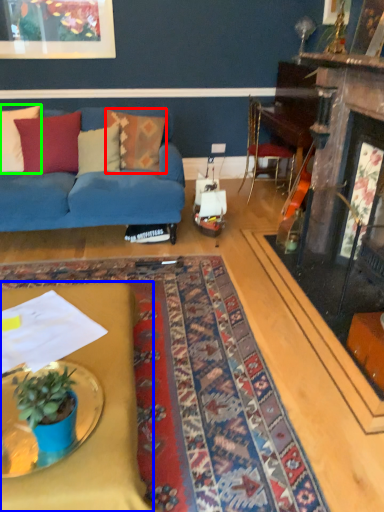
Question: Considering the real-world distances, which object is farthest from pillow (highlighted by a red box)? desk (highlighted by a blue box) or pillow (highlighted by a green box)?

Choices:
 (A) desk
 (B) pillow

Answer: (A)